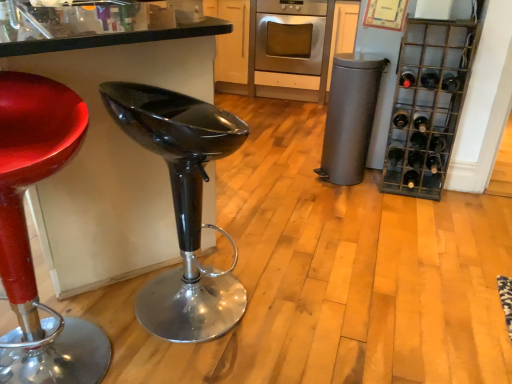
Identify the location of vacant area located to the right-hand side of glossy black stool at center. This screenshot has width=512, height=384. (310, 307).